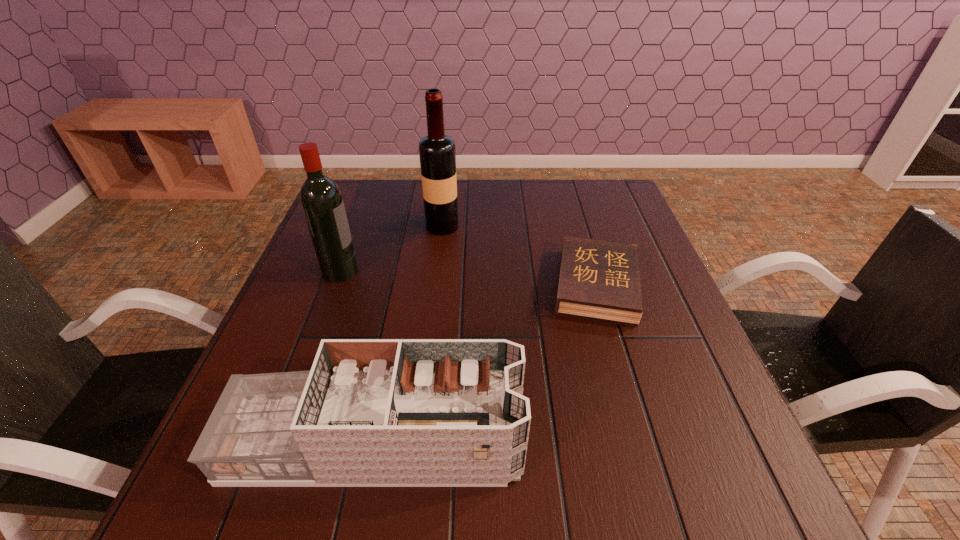
In order to click on vacant space located on the left of the shortest object in this screenshot , I will do `click(394, 286)`.

The image size is (960, 540). I want to click on object that is at the far edge, so click(437, 152).

Locate an element on the screen. object that is at the near edge is located at coordinates (371, 412).

I want to click on wine bottle that is at the left edge, so click(321, 199).

You are a GUI agent. You are given a task and a screenshot of the screen. Output one action in this format:
    pyautogui.click(x=<x>, y=<y>)
    Task: Click on the dollhouse situated at the left edge
    The height and width of the screenshot is (540, 960).
    Given the screenshot: What is the action you would take?
    pyautogui.click(x=371, y=412)

Identify the location of object at the right edge. The height and width of the screenshot is (540, 960). (600, 279).

The image size is (960, 540). Identify the location of object that is positioned at the near left corner. (371, 412).

Where is `free space at the far edge`? The width and height of the screenshot is (960, 540). free space at the far edge is located at coordinates (396, 188).

Identify the location of vacant area at the near edge. (372, 497).

In the image, there is a desktop. Find the location of `vacant area at the left edge`. vacant area at the left edge is located at coordinates [303, 284].